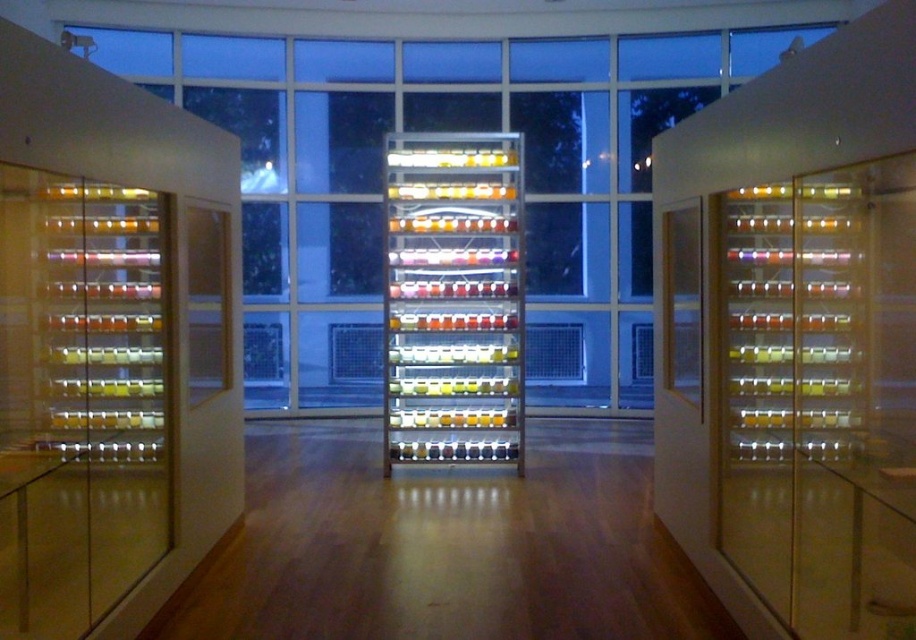
Question: Observing the image, what is the correct spatial positioning of clear glass cabinet at right in reference to translucent glass shelves at left?

Choices:
 (A) above
 (B) below

Answer: (A)

Question: Does translucent glass shelves at left appear on the left side of translucent plastic jars at center?

Choices:
 (A) yes
 (B) no

Answer: (A)

Question: Which point is farther to the camera?

Choices:
 (A) translucent plastic jars at center
 (B) clear glass cabinet at right

Answer: (A)

Question: Which object is positioned farthest from the clear glass cabinet at right?

Choices:
 (A) translucent glass shelves at left
 (B) translucent plastic jars at center

Answer: (A)

Question: Is clear glass cabinet at right above translucent plastic jars at center?

Choices:
 (A) yes
 (B) no

Answer: (A)

Question: Which point is closer to the camera taking this photo?

Choices:
 (A) (880, 520)
 (B) (140, 456)

Answer: (A)